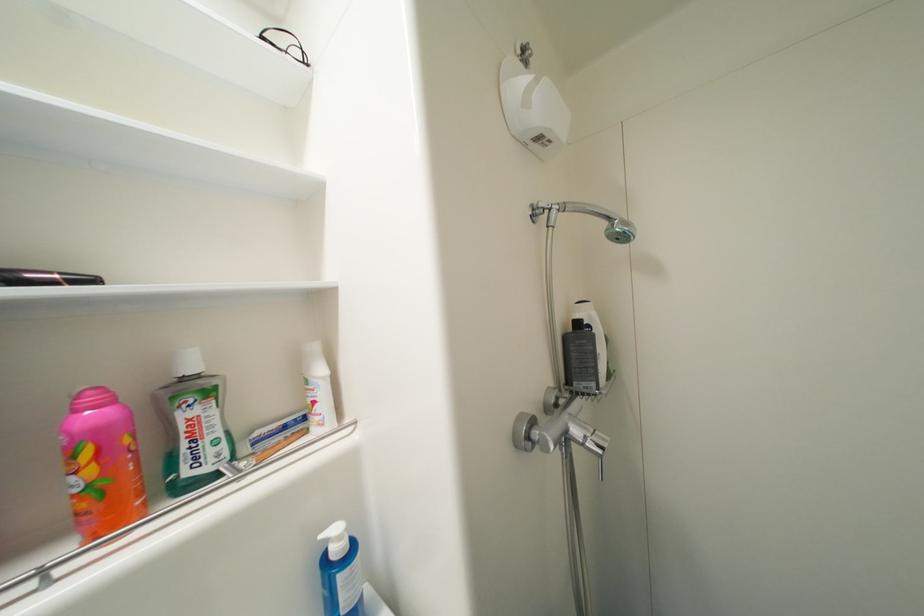
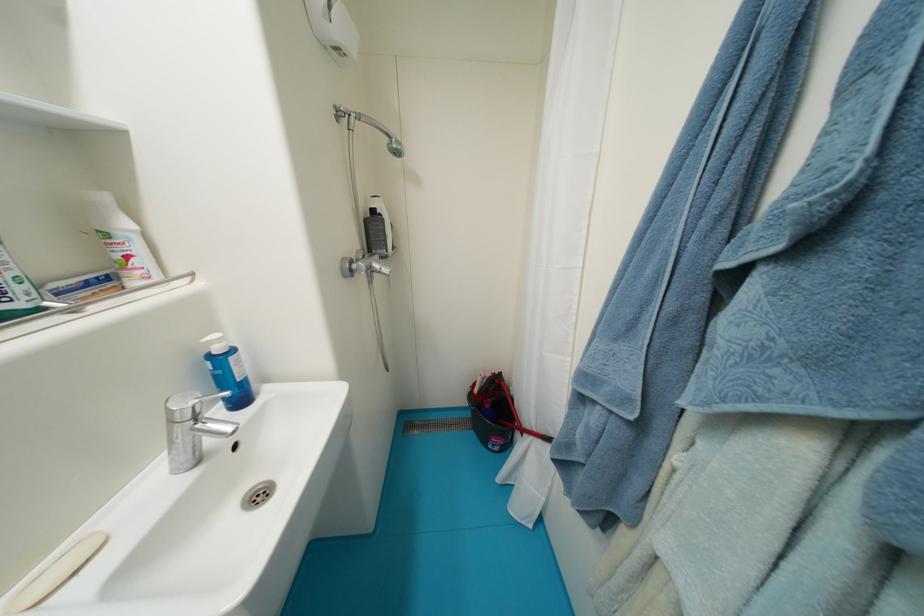
In the second image, find the point that corresponds to (x=582, y=434) in the first image.

(383, 267)